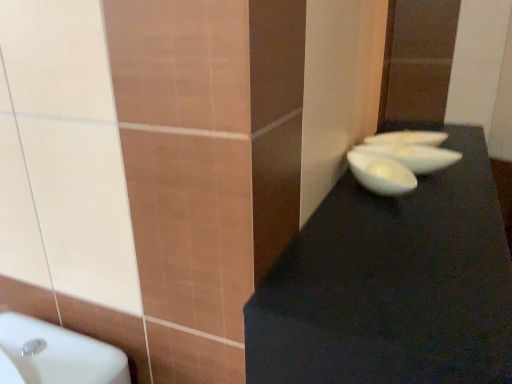
You are a GUI agent. You are given a task and a screenshot of the screen. Output one action in this format:
    pyautogui.click(x=<x>, y=<y>)
    Task: Click on the free space that is to the left of white glossy bowl at center right
    The image size is (512, 384).
    Given the screenshot: What is the action you would take?
    pyautogui.click(x=340, y=196)